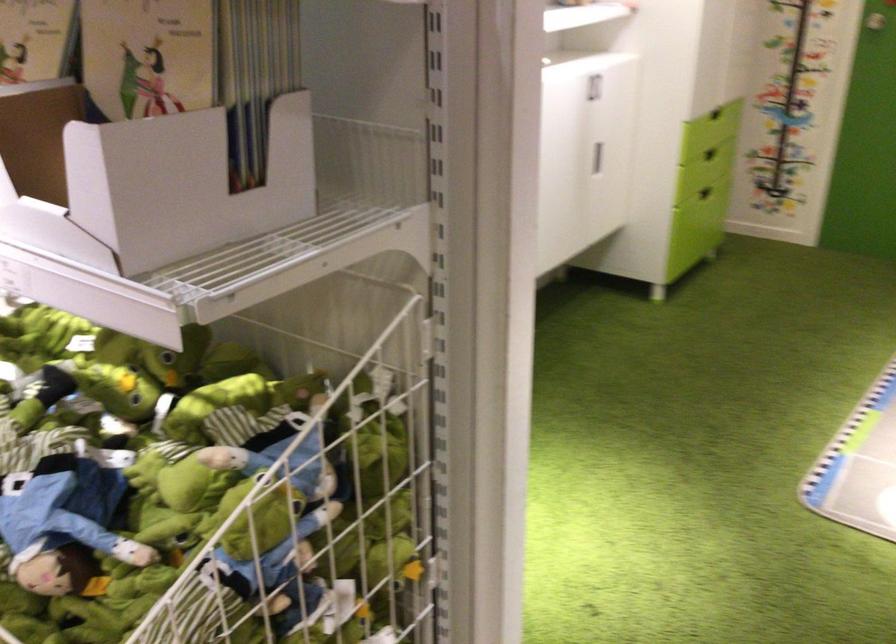
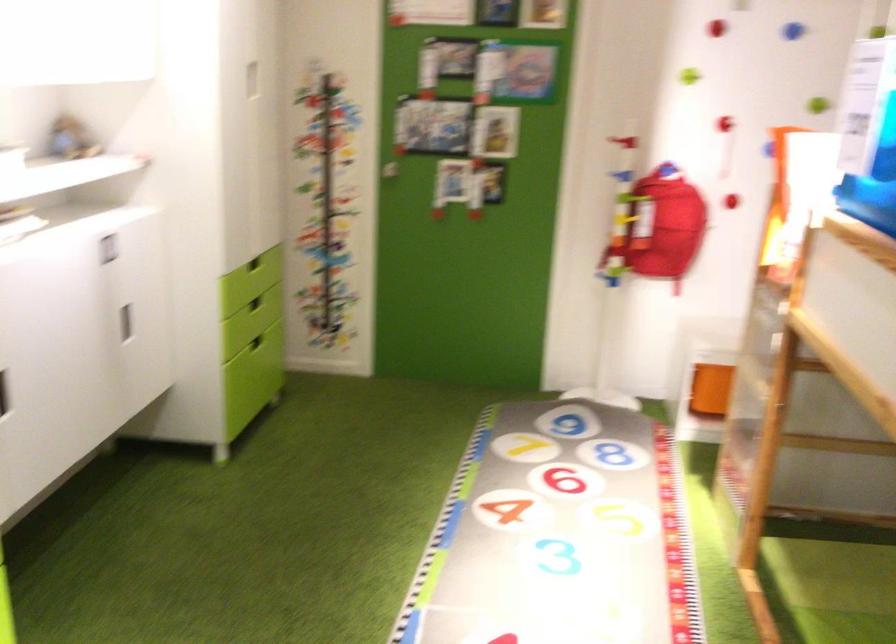
The point at (x=590, y=155) is marked in the first image. Where is the corresponding point in the second image?

(125, 323)